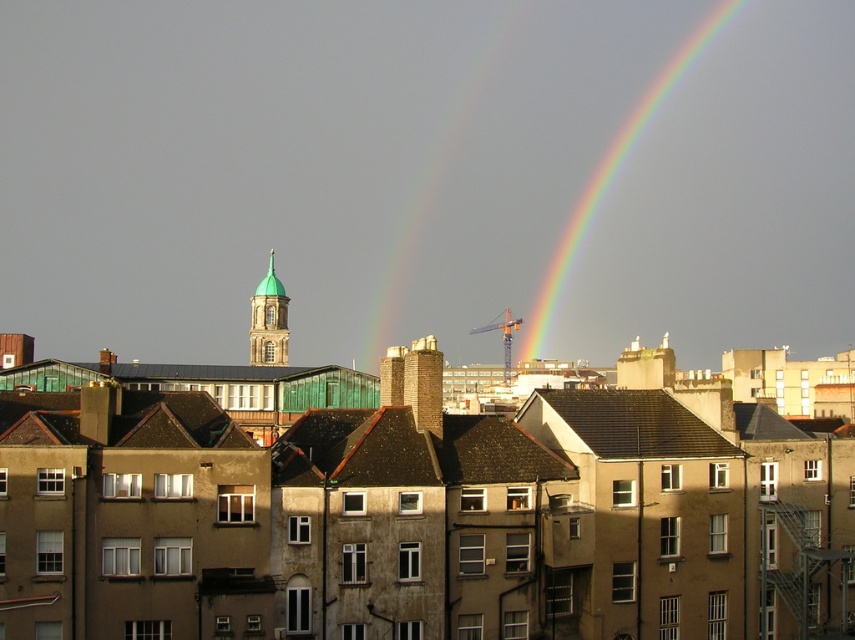
Who is more distant from viewer, (551, 276) or (392, 374)?

Positioned behind is point (551, 276).

Can you confirm if rainbow at upper center is positioned below brick chimney at center?

Incorrect, rainbow at upper center is not positioned below brick chimney at center.

Locate an element on the screen. The image size is (855, 640). rainbow at upper center is located at coordinates coord(612,177).

Identify the location of rainbow at upper center. (612, 177).

Is point (408, 365) farther from viewer compared to point (272, 269)?

No, it is in front of (272, 269).

Is brick chimney at center behind green copper dome at center?

That is False.

Who is more distant from viewer, [402,394] or [249,362]?

Point [249,362]

Where is `brick chimney at center`? The width and height of the screenshot is (855, 640). brick chimney at center is located at coordinates (414, 381).

Can you confirm if rainbow at upper center is positioned to the right of green copper dome at center?

Yes, rainbow at upper center is to the right of green copper dome at center.

Can you confirm if rainbow at upper center is shorter than green copper dome at center?

Incorrect, rainbow at upper center's height does not fall short of green copper dome at center's.

Does point (640, 115) come closer to viewer compared to point (270, 353)?

No, it is not.

Where is `rainbow at upper center`? The height and width of the screenshot is (640, 855). rainbow at upper center is located at coordinates (612, 177).